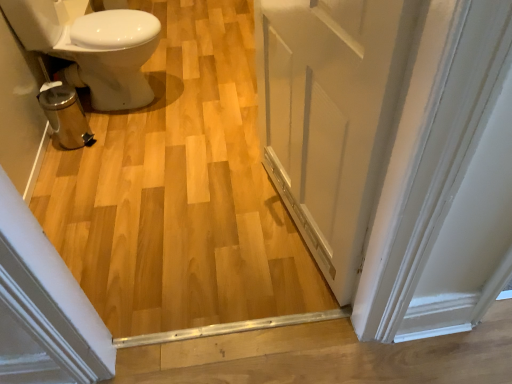
The width and height of the screenshot is (512, 384). Identify the location of vacant area in front of white glossy bidet at left. (122, 152).